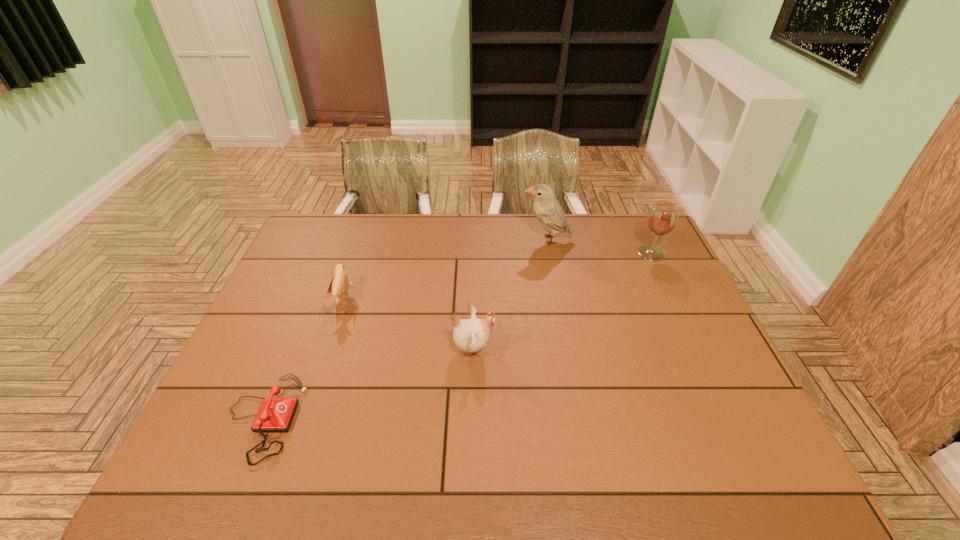
This screenshot has width=960, height=540. Find the location of `vacant space located 0.120m at the face of the tallest object`. vacant space located 0.120m at the face of the tallest object is located at coordinates (488, 240).

You are a GUI agent. You are given a task and a screenshot of the screen. Output one action in this format:
    pyautogui.click(x=<x>, y=<y>)
    Task: Click on the vacant region located at the face of the tallest object
    The image size is (960, 540).
    Given the screenshot: What is the action you would take?
    pyautogui.click(x=491, y=240)

Locate an element on the screen. The image size is (960, 540). free location located on the back of the rightmost object is located at coordinates [x=641, y=232].

Identify the location of vacant point located at the beak of the nearest bird. The height and width of the screenshot is (540, 960). pos(540,350).

Identify the location of vacant space located 0.080m at the beak of the shortest bird. (376, 301).

Locate an element on the screen. free space located 0.360m on the dial of the telephone is located at coordinates (450, 417).

Locate an element on the screen. The image size is (960, 540). bird at the far edge is located at coordinates (548, 211).

Where is `wineglass at the far edge`? wineglass at the far edge is located at coordinates (662, 217).

The image size is (960, 540). In order to click on object that is at the near edge in this screenshot , I will do `click(275, 414)`.

At what (x,y) coordinates should I click in order to perform the action: click on object located at the left edge. Please return your answer as a coordinate pair (x, y). Looking at the image, I should click on (275, 414).